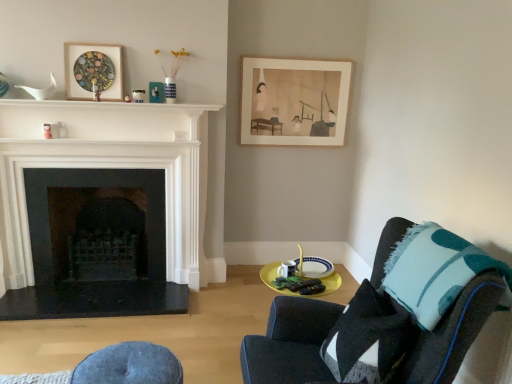
In order to click on vacant point above denim cushion at lower center (from a real-world perspective) in this screenshot , I will do [x=129, y=367].